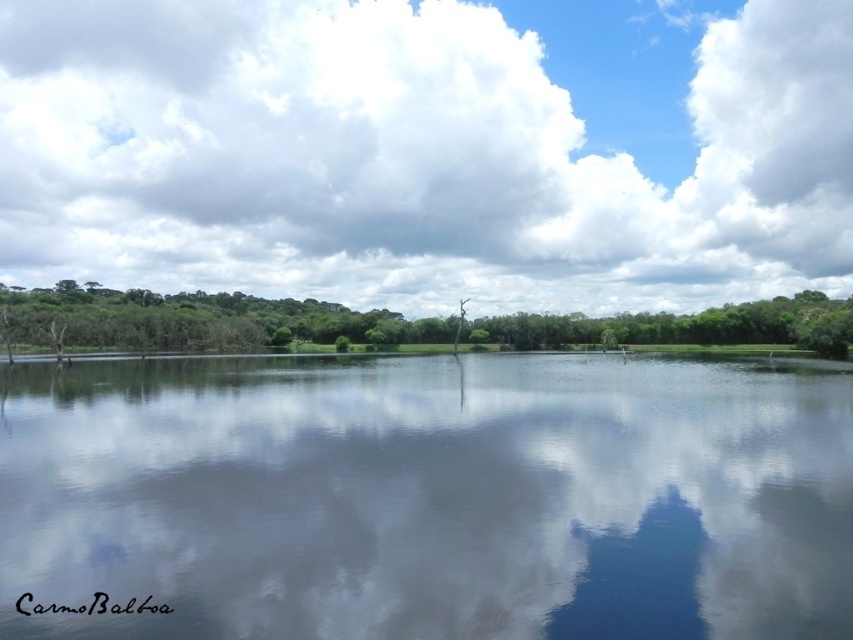
Between smooth reflective water at center and green leafy tree at center, which one appears on the left side from the viewer's perspective?

green leafy tree at center is more to the left.

Can you confirm if smooth reflective water at center is thinner than green leafy tree at center?

Yes.

Does point (424, 408) come farther from viewer compared to point (78, 308)?

No, it is in front of (78, 308).

Find the location of a particular element. This screenshot has height=640, width=853. smooth reflective water at center is located at coordinates (426, 497).

Based on the photo, is the position of smooth reflective water at center more distant than that of cloudy sky at upper center?

No, it is in front of cloudy sky at upper center.

Who is shorter, smooth reflective water at center or cloudy sky at upper center?

With less height is smooth reflective water at center.

Does point (593, 632) come in front of point (595, 93)?

Yes, point (593, 632) is in front of point (595, 93).

The height and width of the screenshot is (640, 853). Find the location of `smooth reflective water at center`. smooth reflective water at center is located at coordinates (426, 497).

Can you confirm if cloudy sky at upper center is positioned above green leafy tree at center?

Indeed, cloudy sky at upper center is positioned over green leafy tree at center.

What do you see at coordinates (418, 154) in the screenshot? I see `cloudy sky at upper center` at bounding box center [418, 154].

You are a GUI agent. You are given a task and a screenshot of the screen. Output one action in this format:
    pyautogui.click(x=<x>, y=<y>)
    Task: Click on the cloudy sky at upper center
    The width and height of the screenshot is (853, 640).
    Given the screenshot: What is the action you would take?
    pyautogui.click(x=418, y=154)